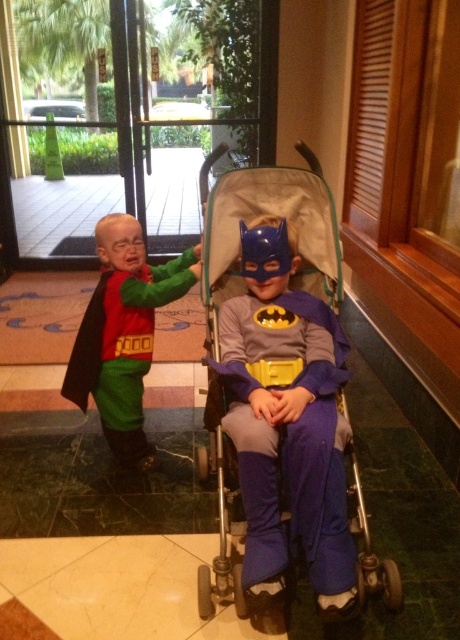
Question: Which point is farther to the camera?

Choices:
 (A) (118, 241)
 (B) (248, 563)
 (C) (210, 316)

Answer: (A)

Question: Can you confirm if blue fabric costume at center is wider than matte green pants at left?

Choices:
 (A) yes
 (B) no

Answer: (B)

Question: Is blue fabric stroller at center below blue fabric costume at center?

Choices:
 (A) yes
 (B) no

Answer: (B)

Question: Based on their relative distances, which object is nearer to the blue fabric costume at center?

Choices:
 (A) matte green pants at left
 (B) blue fabric stroller at center

Answer: (B)

Question: Which of the following is the closest to the observer?

Choices:
 (A) blue fabric stroller at center
 (B) matte green pants at left
 (C) blue fabric costume at center

Answer: (A)

Question: Does blue fabric stroller at center come in front of blue fabric costume at center?

Choices:
 (A) no
 (B) yes

Answer: (B)